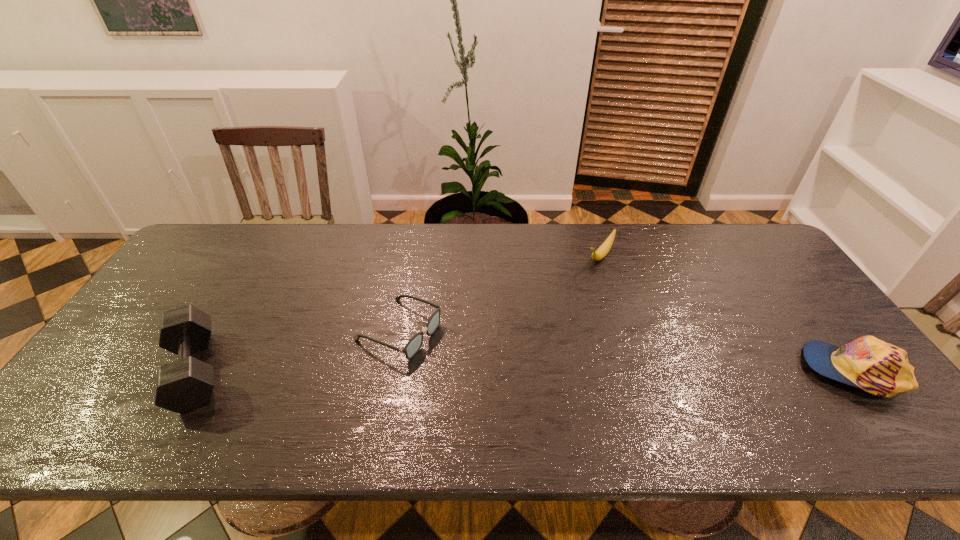
Where is `free point located on the face of the spectacles`? This screenshot has height=540, width=960. free point located on the face of the spectacles is located at coordinates (471, 365).

The image size is (960, 540). I want to click on free space located 0.070m on the face of the spectacles, so click(x=458, y=358).

The image size is (960, 540). What are the coordinates of `free space located 0.280m on the face of the spectacles` in the screenshot? It's located at (533, 395).

You are a GUI agent. You are given a task and a screenshot of the screen. Output one action in this format:
    pyautogui.click(x=<x>, y=<y>)
    Task: Click on the free space located at the stem of the banana
    This screenshot has width=960, height=540.
    Given the screenshot: What is the action you would take?
    click(x=561, y=307)

At what (x,y) coordinates should I click in order to perform the action: click on vacant area situated 0.220m at the stem of the banana. Please return your answer as a coordinate pair (x, y). Looking at the image, I should click on (559, 309).

Identify the location of free space located 0.310m at the stem of the banana. Image resolution: width=960 pixels, height=540 pixels. (542, 328).

You are a GUI agent. You are given a task and a screenshot of the screen. Output one action in this format:
    pyautogui.click(x=<x>, y=<y>)
    Task: Click on the object located at the far edge
    The image size is (960, 540).
    Given the screenshot: What is the action you would take?
    pyautogui.click(x=602, y=251)

Locate an element on the screen. dumbbell that is at the near edge is located at coordinates (185, 384).

Where is `cap present at the near edge`? cap present at the near edge is located at coordinates (880, 368).

The image size is (960, 540). What are the coordinates of `object that is positioned at the left edge` in the screenshot? It's located at (185, 384).